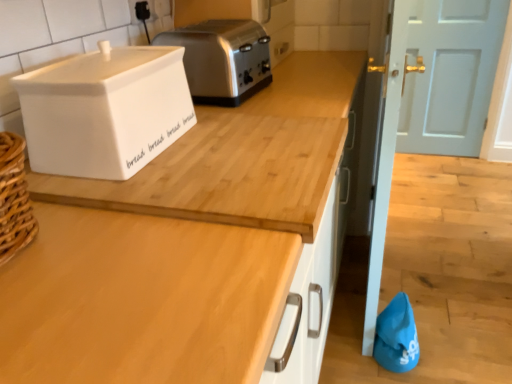
Locate an element on the screen. vacant area that lies to the right of satin silver toaster at upper center is located at coordinates (304, 83).